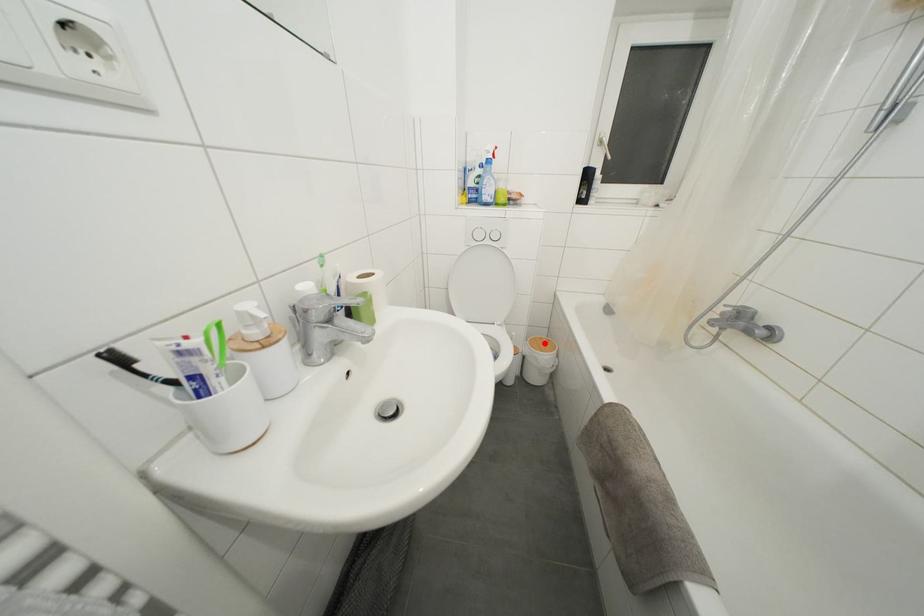
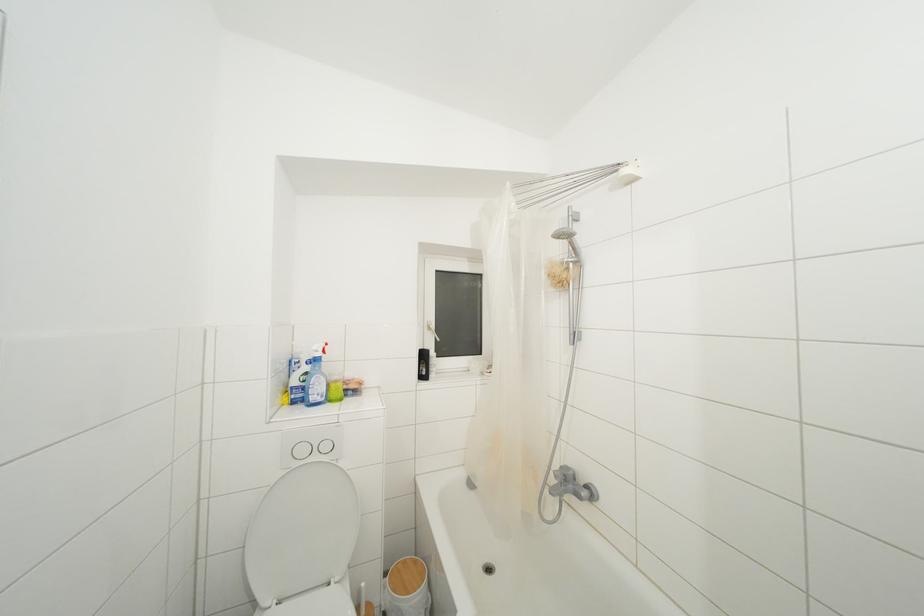
Where in the second image is the point corresponding to the highlighted location from the first image?

(408, 567)